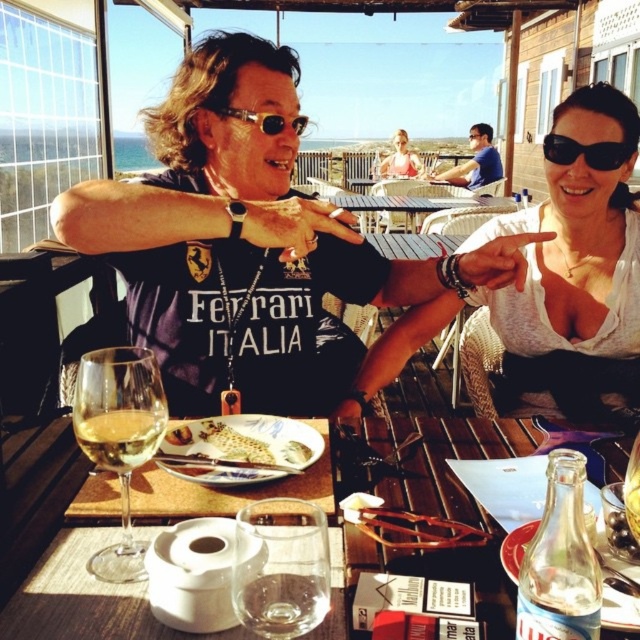
Does clear glass table at center have a greater height compared to translucent glass wine at lower left?

No, clear glass table at center is not taller than translucent glass wine at lower left.

Does clear glass table at center appear on the right side of translucent glass wine at lower left?

Yes, clear glass table at center is to the right of translucent glass wine at lower left.

Is point (420, 509) less distant than point (120, 464)?

No, (420, 509) is further to viewer.

I want to click on clear glass table at center, so click(x=84, y=596).

Which of these two, white glossy fish at center or golden crispy bread at center, stands taller?

With more height is white glossy fish at center.

Is point (253, 474) positioned behind point (273, 461)?

No, it is not.

At what (x,y) coordinates should I click in order to perform the action: click on white glossy fish at center. Please return your answer as a coordinate pair (x, y). Looking at the image, I should click on (240, 449).

How distant is white fabric top at center from transparent glass at table center?

1.13 meters

Looking at this image, does white fabric top at center appear under transparent glass at table center?

Incorrect, white fabric top at center is not positioned below transparent glass at table center.

I want to click on white fabric top at center, so click(566, 269).